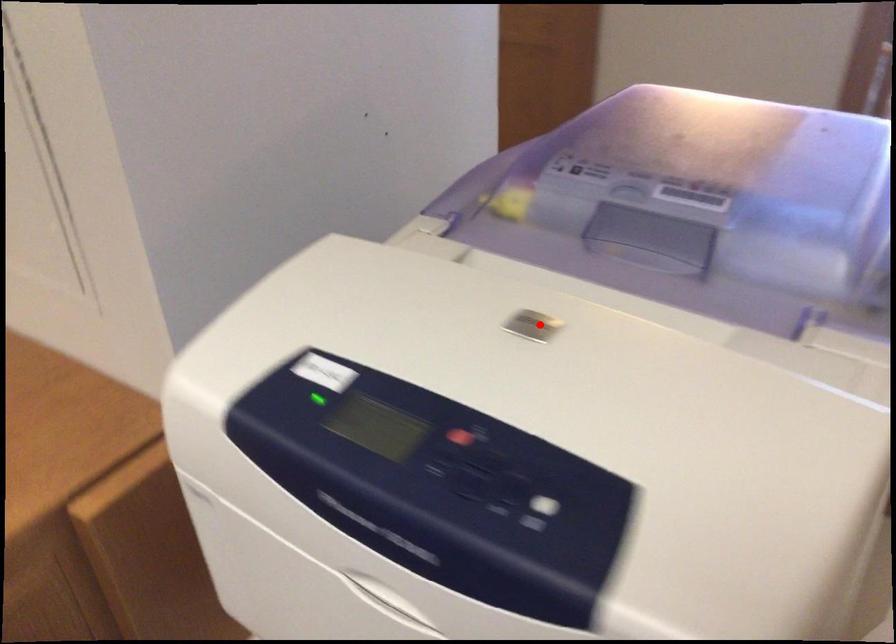
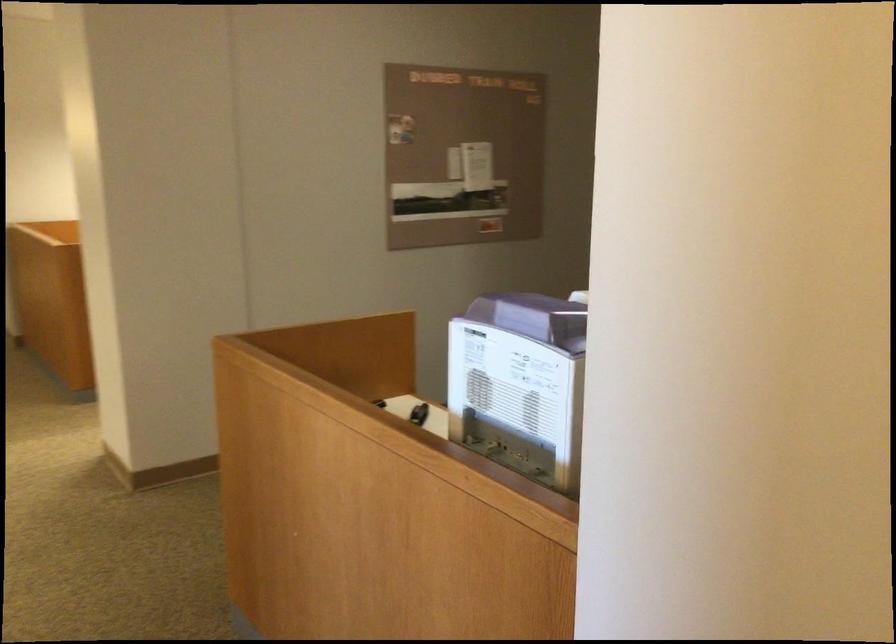
Question: I am providing you with two images of the same scene from different viewpoints. A red point is marked on the first image. Can you still see the location of the red point in image 2?

Choices:
 (A) Yes
 (B) No

Answer: (B)